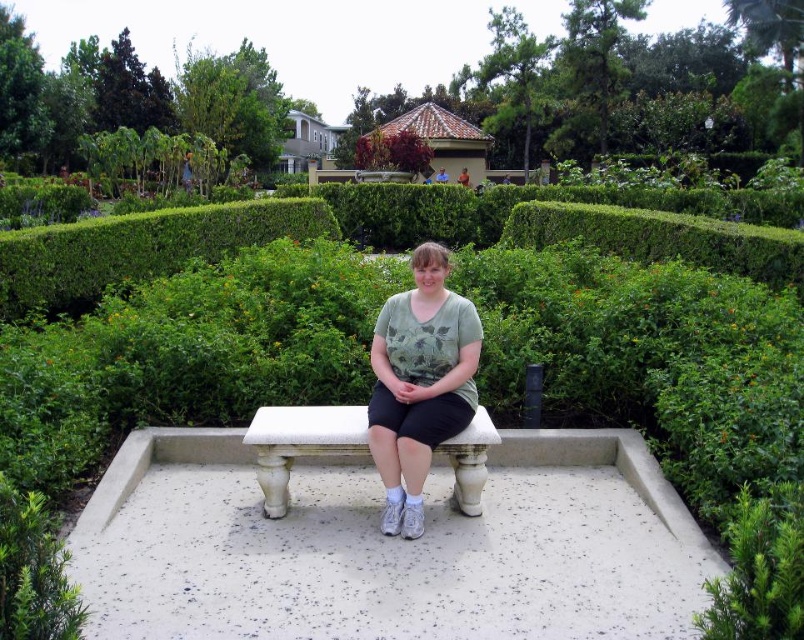
Which is below, green leafy bush at lower right or white stone bench at center?

Positioned lower is green leafy bush at lower right.

Can you confirm if green leafy bush at lower right is thinner than white stone bench at center?

Indeed, green leafy bush at lower right has a lesser width compared to white stone bench at center.

Does point (766, 493) come behind point (306, 451)?

No, (766, 493) is closer to viewer.

The height and width of the screenshot is (640, 804). I want to click on green leafy bush at lower right, so click(x=761, y=566).

Does white speckled concrete bench at center lie behind green leafy bush at lower right?

That is True.

Who is taller, white speckled concrete bench at center or green leafy bush at lower right?

white speckled concrete bench at center is taller.

Is point (622, 540) in front of point (755, 579)?

No.

You are a GUI agent. You are given a task and a screenshot of the screen. Output one action in this format:
    pyautogui.click(x=<x>, y=<y>)
    Task: Click on the white speckled concrete bench at center
    This screenshot has height=640, width=804.
    Given the screenshot: What is the action you would take?
    pyautogui.click(x=388, y=547)

Can you confirm if green matte shirt at center is positioned to the right of white stone bench at center?

Indeed, green matte shirt at center is positioned on the right side of white stone bench at center.

Identify the location of green matte shirt at center. Image resolution: width=804 pixels, height=640 pixels. (419, 384).